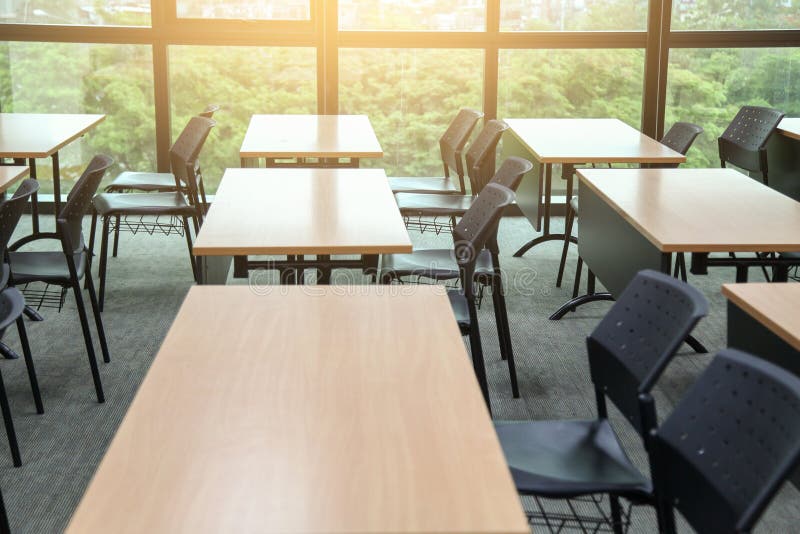
The height and width of the screenshot is (534, 800). Identify the location of window. (98, 69), (108, 2), (194, 2), (216, 75), (397, 80), (409, 15), (602, 17), (598, 65), (733, 65), (736, 9).